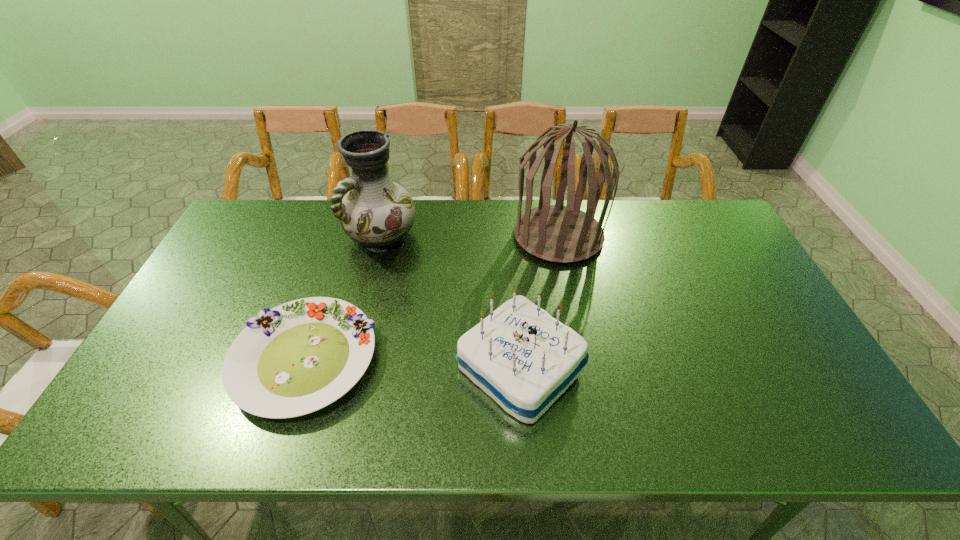
You are a GUI agent. You are given a task and a screenshot of the screen. Output one action in this format:
    pyautogui.click(x=<x>, y=<y>)
    Task: Click on the free space between the salad plate and the third shortest object
    This screenshot has width=960, height=540.
    Given the screenshot: What is the action you would take?
    pyautogui.click(x=344, y=298)

Where is `vacant space that is in between the salad plate and the birthday cake`? The width and height of the screenshot is (960, 540). vacant space that is in between the salad plate and the birthday cake is located at coordinates (413, 364).

Identify the location of empty space between the birdcage and the second tallest object. The width and height of the screenshot is (960, 540). (469, 236).

At what (x,y) coordinates should I click in order to perform the action: click on empty space that is in between the second shortest object and the third shortest object. Please return your answer as a coordinate pair (x, y). Looking at the image, I should click on (450, 302).

The image size is (960, 540). Identify the location of object that is the second closest to the birthday cake. (557, 233).

At what (x,y) coordinates should I click in order to perform the action: click on object that is the closest to the third tallest object. Please return your answer as a coordinate pair (x, y). Image resolution: width=960 pixels, height=540 pixels. Looking at the image, I should click on (299, 357).

Where is `vacant region that satisfies the following two spatial constraints: 1. on the back side of the vase; 2. on the left side of the birdcage`? vacant region that satisfies the following two spatial constraints: 1. on the back side of the vase; 2. on the left side of the birdcage is located at coordinates (381, 235).

Where is `vacant position in the image that satisfies the following two spatial constraints: 1. on the back side of the birdcage; 2. on the right side of the shortest object`? This screenshot has width=960, height=540. vacant position in the image that satisfies the following two spatial constraints: 1. on the back side of the birdcage; 2. on the right side of the shortest object is located at coordinates (x=347, y=235).